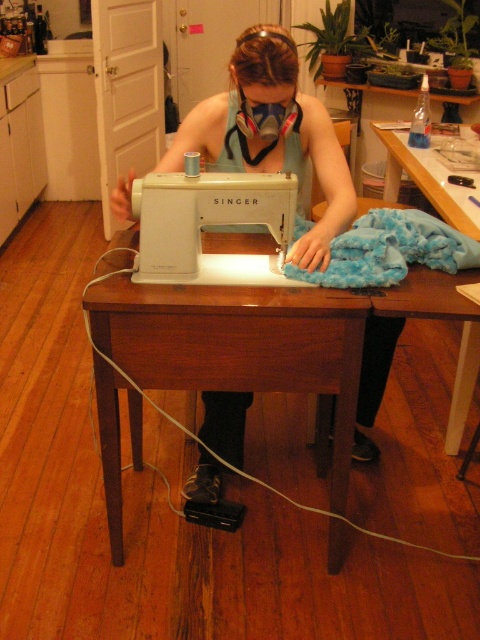
Question: Which of the following is the closest to the observer?

Choices:
 (A) white plastic sewing machine at center
 (B) wooden table at lower right
 (C) matte white sewing machine at center
 (D) brown wood table at center

Answer: (D)

Question: Can you confirm if matte white sewing machine at center is bigger than wooden table at lower right?

Choices:
 (A) no
 (B) yes

Answer: (A)

Question: Which object appears closest to the camera in this image?

Choices:
 (A) white plastic sewing machine at center
 (B) matte white sewing machine at center
 (C) wooden table at lower right

Answer: (B)

Question: Is white plastic sewing machine at center to the left of wooden table at lower right from the viewer's perspective?

Choices:
 (A) yes
 (B) no

Answer: (A)

Question: Among these objects, which one is nearest to the camera?

Choices:
 (A) matte white sewing machine at center
 (B) white plastic sewing machine at center
 (C) brown wood table at center
 (D) wooden table at lower right

Answer: (C)

Question: Can you confirm if brown wood table at center is bigger than matte white sewing machine at center?

Choices:
 (A) yes
 (B) no

Answer: (A)